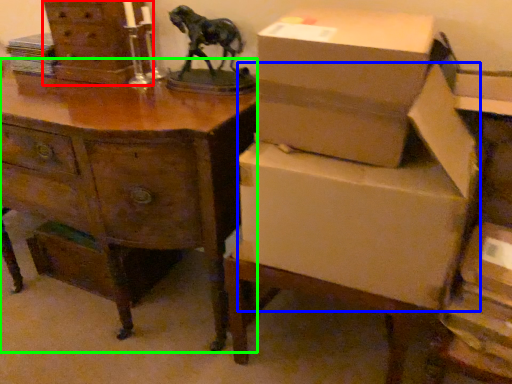
Question: Which object is the farthest from chest of drawers (highlighted by a red box)? Choose among these: cardboard box (highlighted by a blue box) or desk (highlighted by a green box).

Choices:
 (A) cardboard box
 (B) desk

Answer: (A)